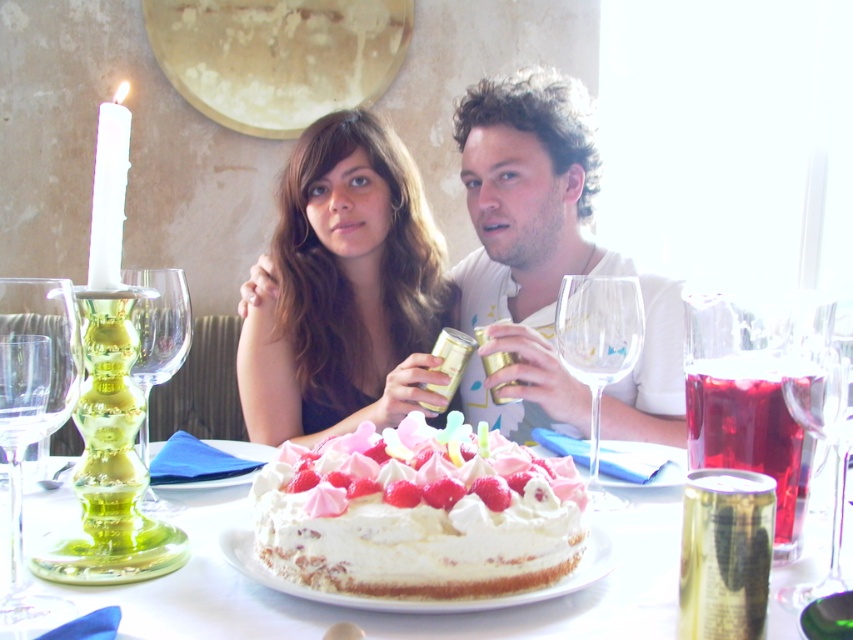
Question: Is white matte wine glass at upper center thinner than white wax candle at left?

Choices:
 (A) yes
 (B) no

Answer: (B)

Question: Which of the following is the farthest from the observer?

Choices:
 (A) transparent glass wine glass at center
 (B) white frosted cake at center

Answer: (A)

Question: Can you confirm if whipped cream cake at center is thinner than transparent glass at center?

Choices:
 (A) no
 (B) yes

Answer: (A)

Question: Is the position of white matte wine glass at upper center less distant than that of transparent glass wine glass at center?

Choices:
 (A) no
 (B) yes

Answer: (A)

Question: Among these points, which one is nearest to the camera?

Choices:
 (A) pos(666,577)
 (B) pos(102,108)

Answer: (B)

Question: Which point is closer to the camera taking this photo?

Choices:
 (A) (590, 324)
 (B) (96, 154)

Answer: (B)